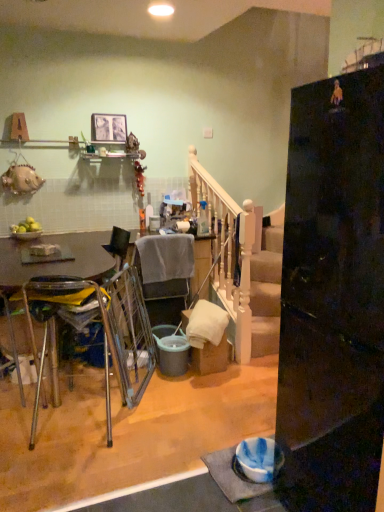
What are the coordinates of `vacant region in front of matte gray bucket at center` in the screenshot? It's located at (182, 394).